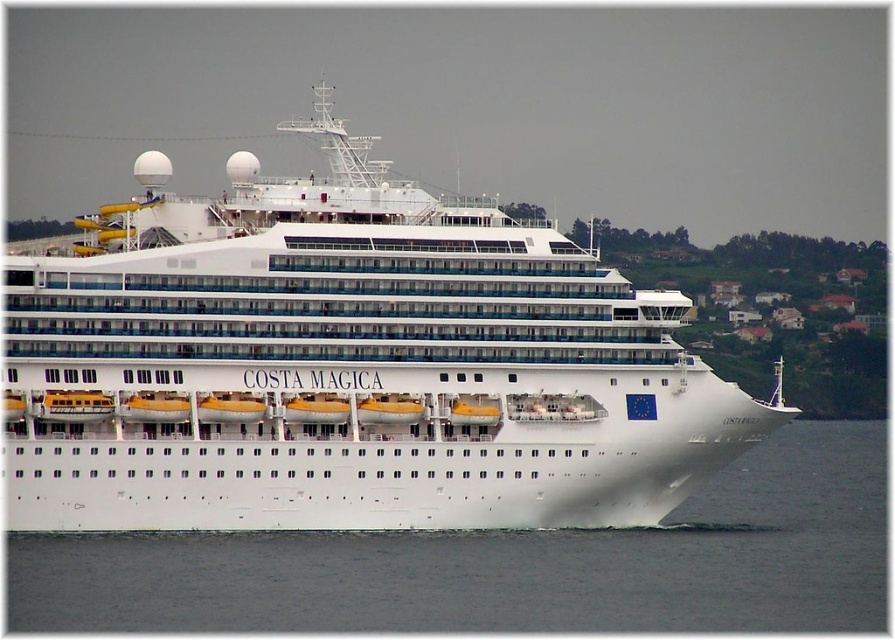
Does white glossy cruise ship at center have a smaller size compared to white water at lower center?

No.

Is point (143, 477) closer to viewer compared to point (632, 572)?

No, it is not.

Which is in front, point (538, 481) or point (112, 621)?

Positioned in front is point (112, 621).

In order to click on white glossy cruise ship at center in this screenshot , I will do `click(347, 365)`.